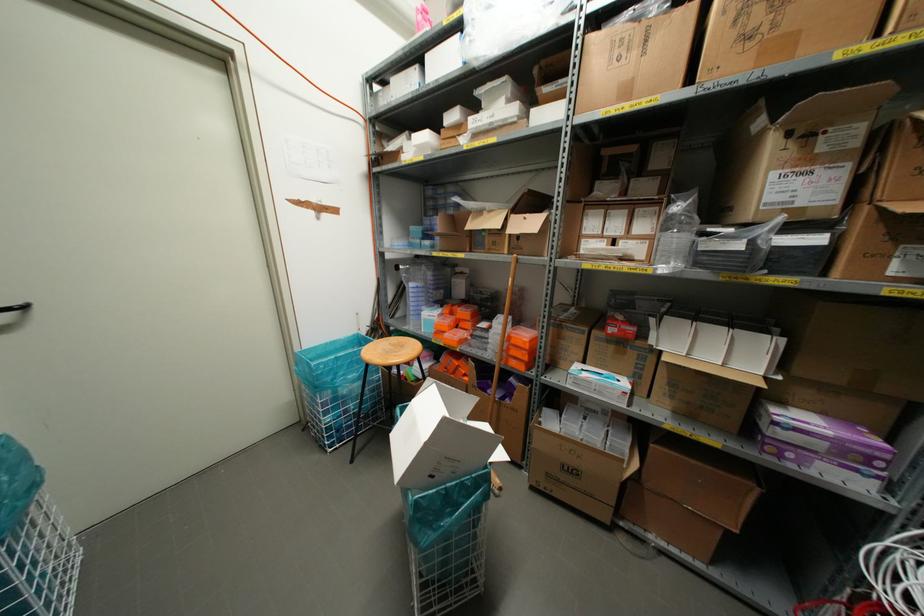
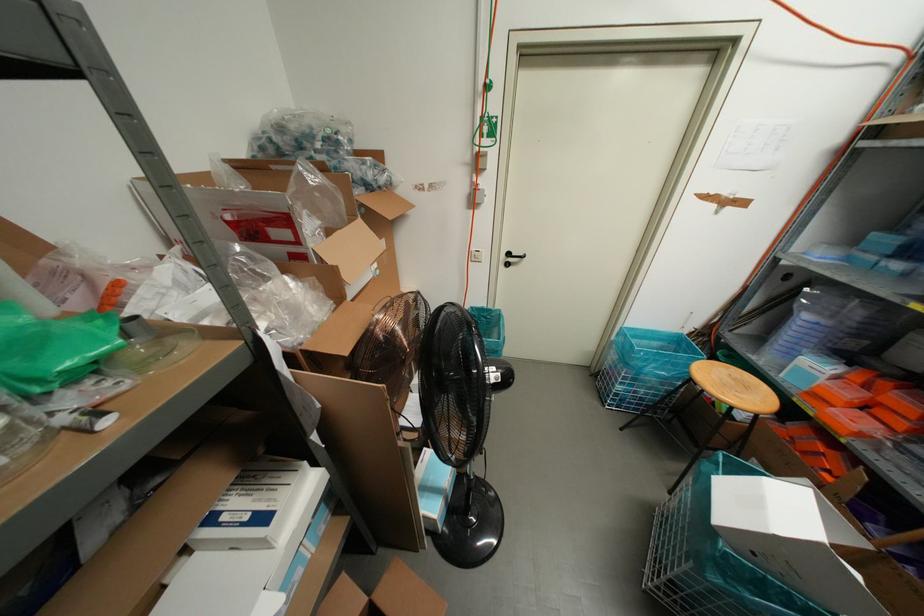
In the second image, find the point that corresponds to (x=447, y=320) in the first image.

(852, 394)